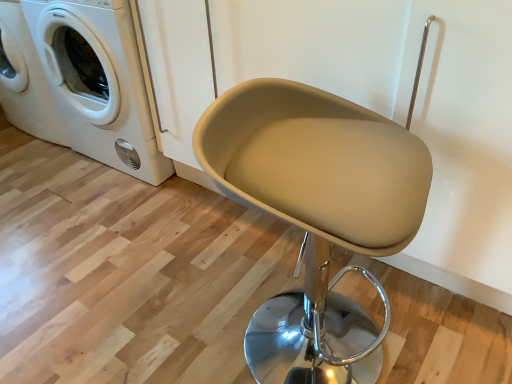
Where is `vacant space that is to the left of beige fabric swivel chair at center`? This screenshot has width=512, height=384. vacant space that is to the left of beige fabric swivel chair at center is located at coordinates (173, 321).